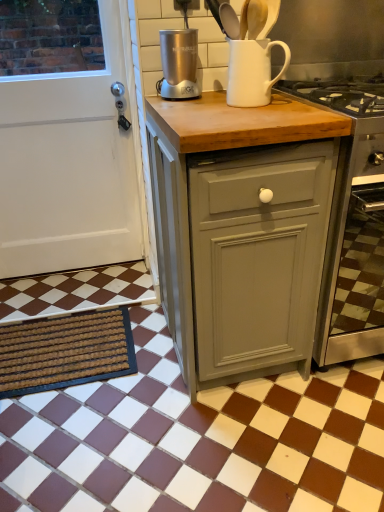
Image resolution: width=384 pixels, height=512 pixels. I want to click on vacant area in front of brown textured mat at lower left, so click(82, 440).